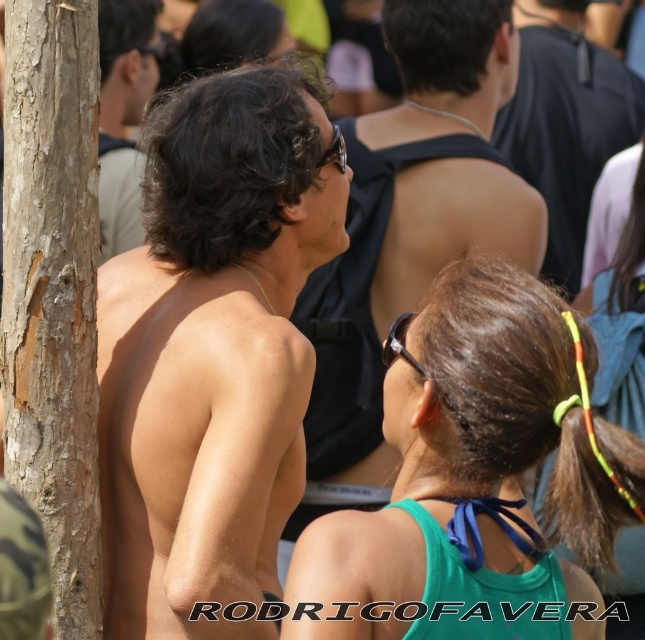
Question: Which object is farther from the camera taking this photo?

Choices:
 (A) black matte tank top at upper center
 (B) matte skin at left
 (C) brown rough bark at left
 (D) matte black tank top at center

Answer: (A)

Question: Which point is farther to the camera?

Choices:
 (A) matte skin at left
 (B) matte black tank top at center
 (C) brown rough bark at left
 (D) black matte tank top at upper center

Answer: (D)

Question: Estimate the real-world distances between objects in this image. Which object is farther from the green fabric ponytail at upper right?

Choices:
 (A) brown rough bark at left
 (B) dark brown hair at upper center
 (C) matte skin at left
 (D) matte black tank top at center

Answer: (B)

Question: In this image, where is matte skin at left located relative to brown rough bark at left?

Choices:
 (A) above
 (B) below

Answer: (B)

Question: Does brown rough bark at left have a larger size compared to black matte tank top at upper center?

Choices:
 (A) no
 (B) yes

Answer: (A)

Question: Is matte skin at left positioned behind black matte tank top at upper center?

Choices:
 (A) yes
 (B) no

Answer: (B)